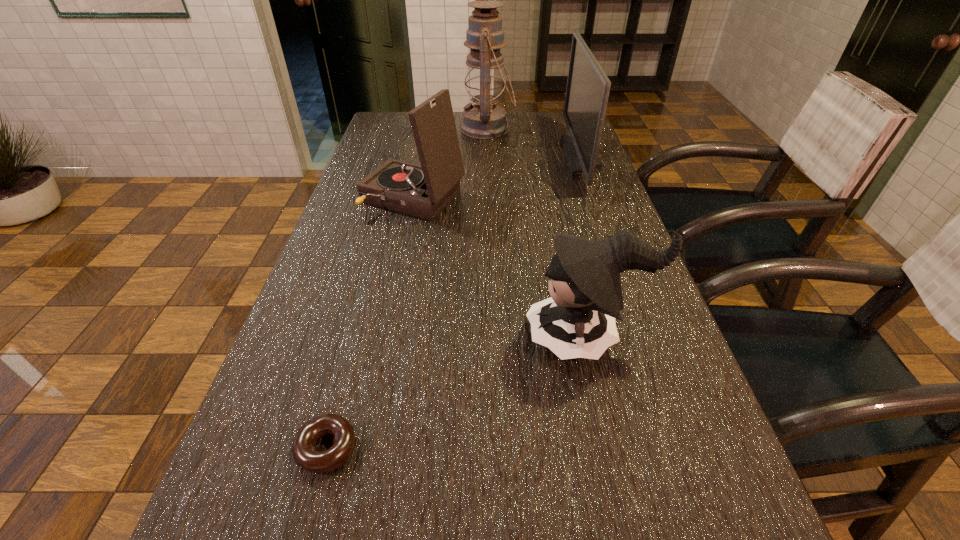
At what (x,y) coordinates should I click in order to perform the action: click on vacant space located on the right of the phonograph record. Please return your answer as a coordinate pair (x, y). The width and height of the screenshot is (960, 540). Looking at the image, I should click on (550, 197).

This screenshot has width=960, height=540. I want to click on vacant point located 0.360m at the face of the fourth farthest object, so click(x=342, y=338).

Identify the location of vacant space located 0.100m at the face of the fourth farthest object. The width and height of the screenshot is (960, 540). (475, 338).

Image resolution: width=960 pixels, height=540 pixels. Find the location of `free region located 0.150m at the face of the fourth farthest object`. free region located 0.150m at the face of the fourth farthest object is located at coordinates (449, 338).

Find the location of `vacant region located on the back of the shortest object`. vacant region located on the back of the shortest object is located at coordinates (365, 305).

Where is `oil lamp located at the far edge`? This screenshot has width=960, height=540. oil lamp located at the far edge is located at coordinates (485, 79).

The height and width of the screenshot is (540, 960). I want to click on monitor positioned at the far edge, so click(587, 92).

This screenshot has width=960, height=540. Identify the location of phonograph record present at the left edge. (423, 191).

Find the location of `doughnut that is at the left edge`. doughnut that is at the left edge is located at coordinates (305, 455).

Find the location of a particular element. monitor present at the right edge is located at coordinates (587, 92).